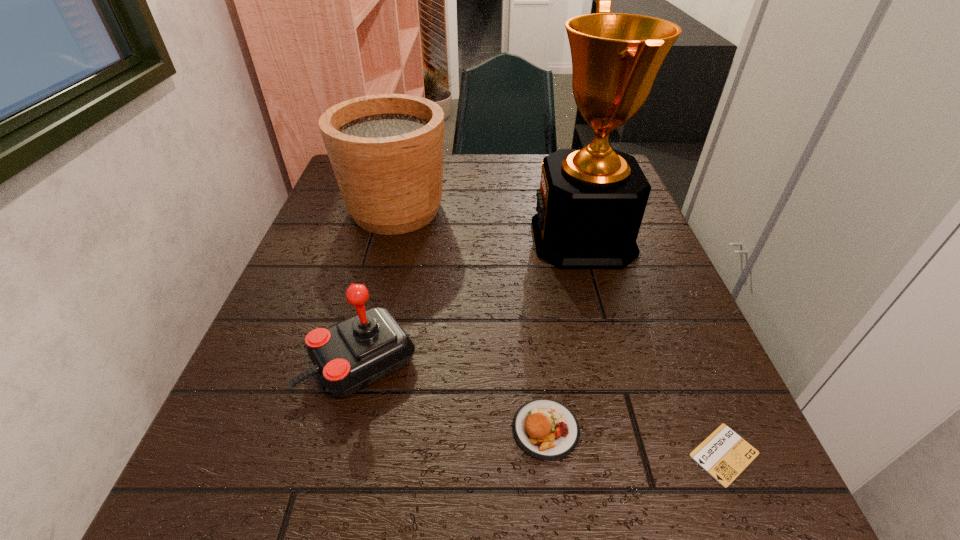
At what (x,y) coordinates should I click in order to perform the action: click on vacant area that lies between the second shortest object and the shortest object. Please return your answer as a coordinate pair (x, y). Looking at the image, I should click on pos(635,442).

I want to click on vacant point located between the second shortest object and the tallest object, so click(x=564, y=334).

Find the location of a particular element. the closest object to the identity card is located at coordinates (546, 429).

Choose which object is the nearest neighbor to the second tallest object. Please provide its 2D coordinates. Your answer should be formatted as a tuple, i.e. [(x, y)], where the tuple contains the x and y coordinates of a point satisfying the conditions above.

[(591, 202)]